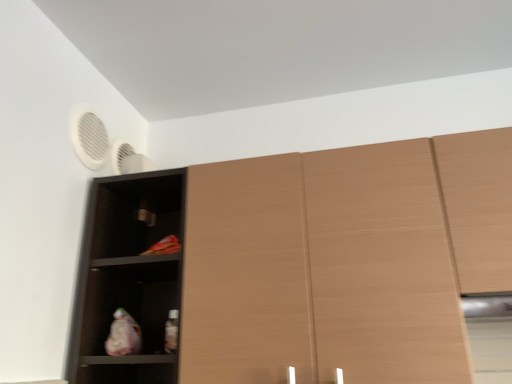
Question: Is white matte fan at upper left positioned before wooden cupboard at center?

Choices:
 (A) yes
 (B) no

Answer: (B)

Question: Could you tell me if white matte fan at upper left is turned towards wooden cupboard at center?

Choices:
 (A) no
 (B) yes

Answer: (A)

Question: Is white matte fan at upper left positioned far away from wooden cupboard at center?

Choices:
 (A) yes
 (B) no

Answer: (B)

Question: Is white matte fan at upper left taller than wooden cupboard at center?

Choices:
 (A) no
 (B) yes

Answer: (A)

Question: Is white matte fan at upper left surrounding wooden cupboard at center?

Choices:
 (A) yes
 (B) no

Answer: (B)

Question: Looking at the image, does wooden cupboard at center seem bigger or smaller compared to white matte fan at upper left?

Choices:
 (A) big
 (B) small

Answer: (A)

Question: From their relative heights in the image, would you say wooden cupboard at center is taller or shorter than white matte fan at upper left?

Choices:
 (A) short
 (B) tall

Answer: (B)

Question: In the image, is wooden cupboard at center on the left side or the right side of white matte fan at upper left?

Choices:
 (A) left
 (B) right

Answer: (B)

Question: Considering the positions of point (351, 304) and point (87, 117), is point (351, 304) closer or farther from the camera than point (87, 117)?

Choices:
 (A) farther
 (B) closer

Answer: (B)

Question: From the image's perspective, is matte black shelf at left located above or below wooden cupboard at center?

Choices:
 (A) above
 (B) below

Answer: (B)

Question: Considering their positions, is matte black shelf at left located in front of or behind wooden cupboard at center?

Choices:
 (A) behind
 (B) front

Answer: (A)

Question: Looking at their shapes, would you say matte black shelf at left is wider or thinner than wooden cupboard at center?

Choices:
 (A) thin
 (B) wide

Answer: (A)

Question: Considering the positions of matte black shelf at left and wooden cupboard at center in the image, is matte black shelf at left taller or shorter than wooden cupboard at center?

Choices:
 (A) tall
 (B) short

Answer: (A)

Question: Is point (140, 178) positioned closer to the camera than point (489, 220)?

Choices:
 (A) closer
 (B) farther

Answer: (B)

Question: From a real-world perspective, relative to light brown wood cabinet at right, is matte black shelf at left vertically above or below?

Choices:
 (A) below
 (B) above

Answer: (A)